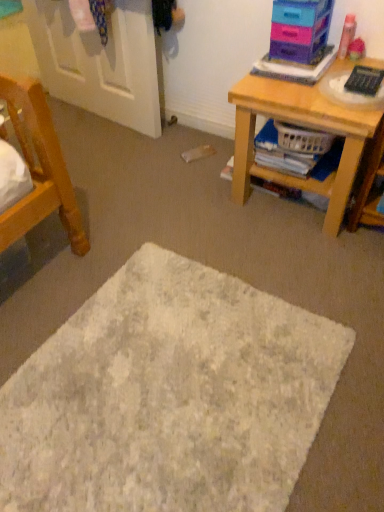
Find the location of `free location in front of wooden desk at right`. free location in front of wooden desk at right is located at coordinates point(296,260).